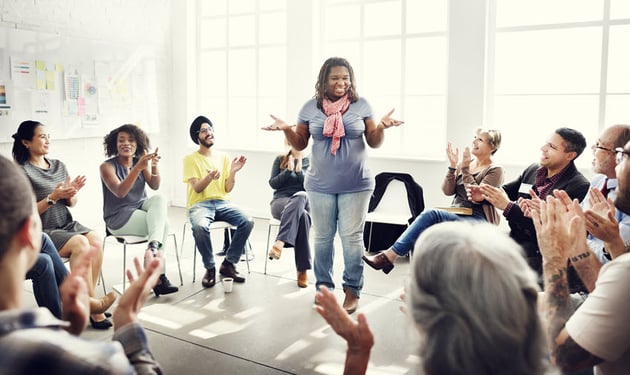
This screenshot has height=375, width=630. I want to click on chair legs, so click(104, 238), click(122, 247), click(172, 247), click(181, 235), click(193, 250), click(247, 252), click(268, 237), click(369, 231), click(103, 279).